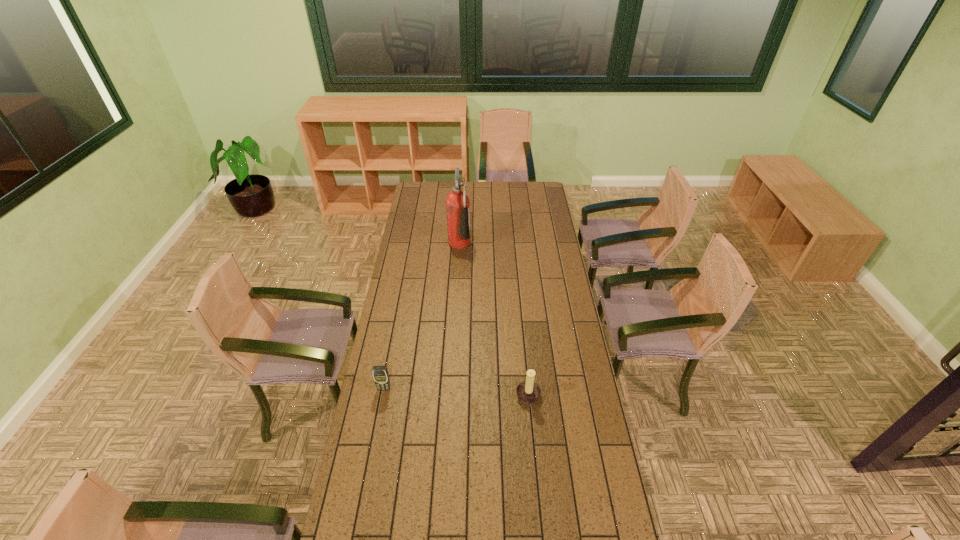
Locate an element on the screen. vacant area that satisfies the following two spatial constraints: 1. on the front of the tallest object near the operation label; 2. on the front face of the cellular telephone is located at coordinates (451, 388).